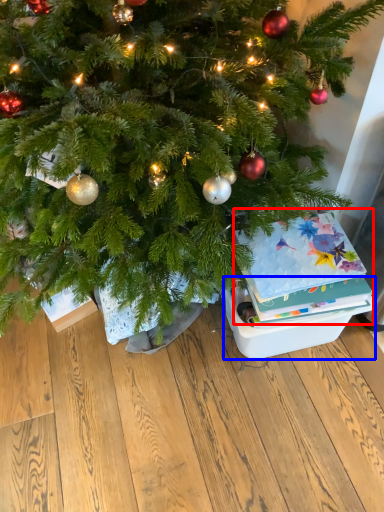
Question: Among these objects, which one is farthest to the camera, christmas card (highlighted by a red box) or storage box (highlighted by a blue box)?

Choices:
 (A) christmas card
 (B) storage box

Answer: (B)